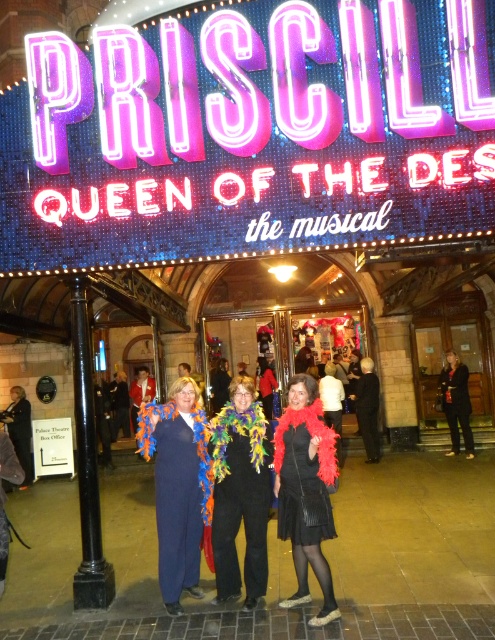
Does point (171, 442) lie in front of point (258, 419)?

Yes, it is.

What do you see at coordinates (179, 486) in the screenshot? The height and width of the screenshot is (640, 495). I see `blue velvet scarf at center` at bounding box center [179, 486].

What are the coordinates of `blue velvet scarf at center` in the screenshot? It's located at (179, 486).

Between multicolored feather boa at center and velvet red scarf at center, which one is positioned higher?

multicolored feather boa at center is above.

Can you confirm if multicolored feather boa at center is positioned to the left of velvet red scarf at center?

Yes, multicolored feather boa at center is to the left of velvet red scarf at center.

Is point (243, 388) more distant than point (283, 451)?

That is True.

At what (x,y) coordinates should I click in order to perform the action: click on multicolored feather boa at center. Please return your answer as a coordinate pair (x, y). This screenshot has height=640, width=495. Looking at the image, I should click on (241, 493).

What do you see at coordinates (305, 492) in the screenshot? This screenshot has height=640, width=495. I see `velvet red scarf at center` at bounding box center [305, 492].

Measure the distance from velvet red scarf at center to black polished metal pole at left.

A distance of 28.98 feet exists between velvet red scarf at center and black polished metal pole at left.

Who is more forward, (303, 580) or (88, 573)?

Point (88, 573)

This screenshot has width=495, height=640. Identify the location of velvet red scarf at center. (305, 492).